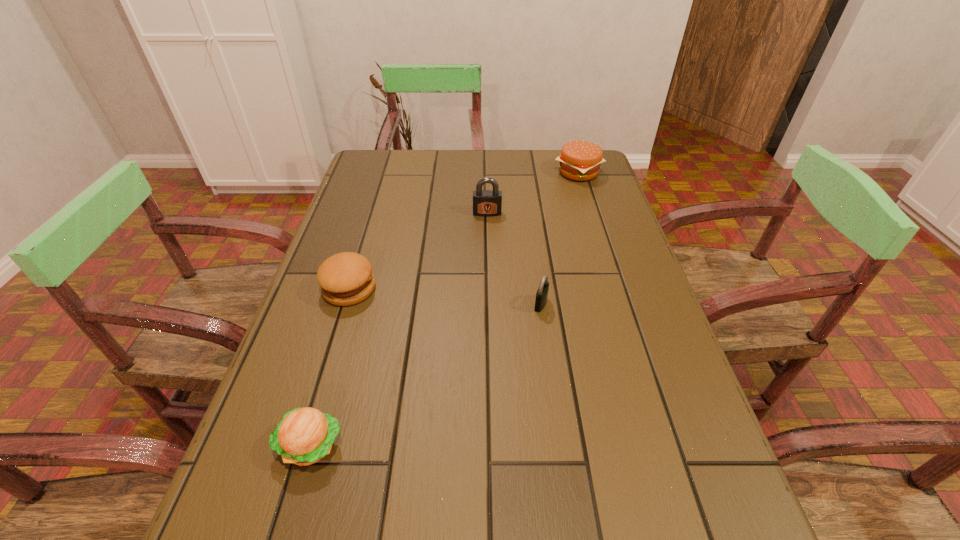
The height and width of the screenshot is (540, 960). What are the coordinates of `vacant area situated on the back of the second farthest hamburger` in the screenshot? It's located at (373, 212).

In order to click on free space located on the left of the nearer padlock in this screenshot , I will do `click(502, 304)`.

Identify the location of free spot located on the right of the nearest hamburger. The image size is (960, 540). coord(474,446).

You are a GUI agent. You are given a task and a screenshot of the screen. Output one action in this format:
    pyautogui.click(x=<x>, y=<y>)
    Task: Click on the object at the far edge
    Image resolution: width=960 pixels, height=540 pixels.
    Given the screenshot: What is the action you would take?
    pyautogui.click(x=580, y=160)

The width and height of the screenshot is (960, 540). Find the location of `object at the right edge`. object at the right edge is located at coordinates (580, 160).

Locate an element on the screen. object present at the far right corner is located at coordinates (580, 160).

Where is `vacant point at the far edge`? The width and height of the screenshot is (960, 540). vacant point at the far edge is located at coordinates (542, 160).

I want to click on vacant region at the left edge, so click(x=331, y=399).

Find the location of a particular element. Image resolution: width=960 pixels, height=540 pixels. vacant space at the right edge is located at coordinates (581, 222).

Identify the location of vacant region at the far left corner of the desktop. This screenshot has width=960, height=540. (391, 154).